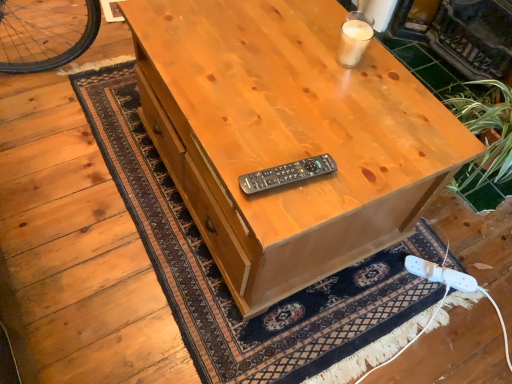
Question: Is black plastic remote at center spatially inside white plastic game controller at lower right, or outside of it?

Choices:
 (A) outside
 (B) inside

Answer: (A)

Question: From their relative heights in the image, would you say black plastic remote at center is taller or shorter than white plastic game controller at lower right?

Choices:
 (A) short
 (B) tall

Answer: (B)

Question: Estimate the real-world distances between objects in this image. Which object is farther from the green tile fireplace at upper right?

Choices:
 (A) natural wood desk at center
 (B) black plastic remote at center
 (C) white plastic game controller at lower right

Answer: (B)

Question: Which is farther from the green tile fireplace at upper right?

Choices:
 (A) black plastic remote at center
 (B) natural wood desk at center
 (C) white plastic game controller at lower right

Answer: (A)